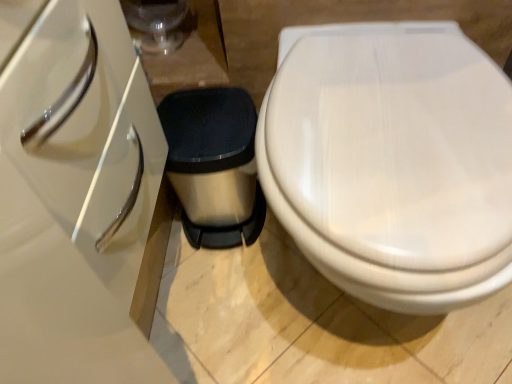
Locate an element on the screen. The image size is (512, 384). white glossy toilet at right is located at coordinates (392, 161).

What do you see at coordinates (392, 161) in the screenshot? The width and height of the screenshot is (512, 384). I see `white glossy toilet at right` at bounding box center [392, 161].

Where is `white glossy toilet at right`? This screenshot has width=512, height=384. white glossy toilet at right is located at coordinates (392, 161).